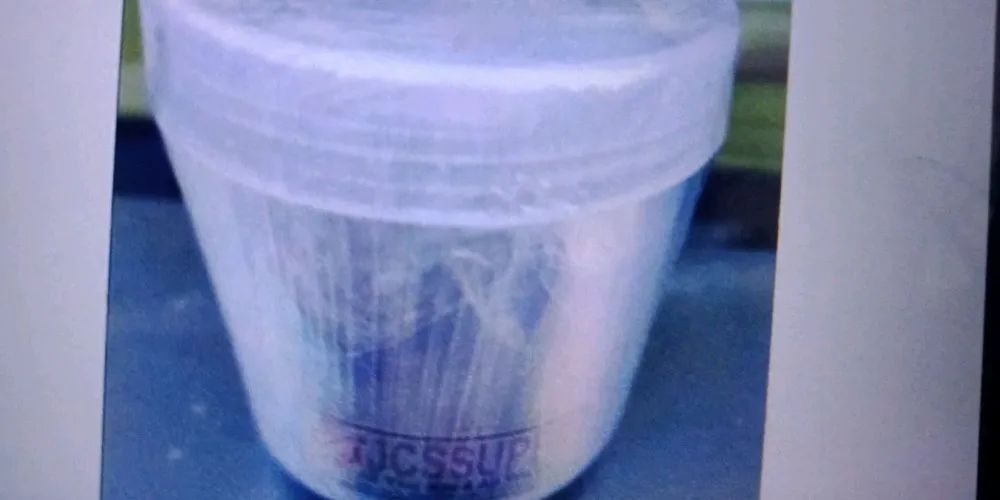
Find the location of a particular element. Image resolution: width=1000 pixels, height=500 pixels. cups is located at coordinates (415, 314).